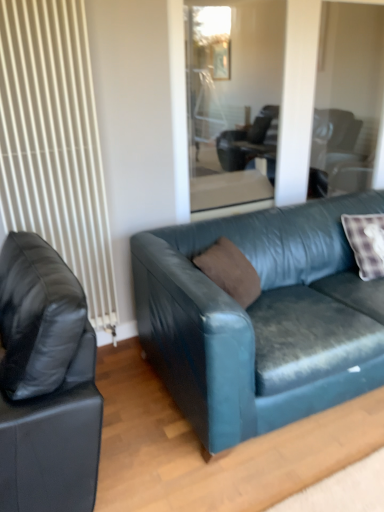
Question: Considering the relative sizes of white ribbed radiator at left and teal leather couch at center, which ranks as the second studio couch in left-to-right order, in the image provided, is white ribbed radiator at left bigger than teal leather couch at center, which ranks as the second studio couch in left-to-right order,?

Choices:
 (A) no
 (B) yes

Answer: (A)

Question: Is white ribbed radiator at left positioned far away from teal leather couch at center, which ranks as the second studio couch in left-to-right order?

Choices:
 (A) no
 (B) yes

Answer: (A)

Question: Considering the relative sizes of white ribbed radiator at left and teal leather couch at center, the 1th studio couch positioned from the right, in the image provided, is white ribbed radiator at left smaller than teal leather couch at center, the 1th studio couch positioned from the right,?

Choices:
 (A) yes
 (B) no

Answer: (A)

Question: Is white ribbed radiator at left thinner than teal leather couch at center, which ranks as the second studio couch in left-to-right order?

Choices:
 (A) no
 (B) yes

Answer: (B)

Question: From a real-world perspective, does white ribbed radiator at left stand above teal leather couch at center, which ranks as the second studio couch in left-to-right order?

Choices:
 (A) yes
 (B) no

Answer: (A)

Question: From the image's perspective, is white ribbed radiator at left on top of teal leather couch at center, the 1th studio couch positioned from the right?

Choices:
 (A) yes
 (B) no

Answer: (A)

Question: Can you confirm if brown suede pillow at center is taller than matte black leather couch at left, which appears as the second studio couch when viewed from the right?

Choices:
 (A) yes
 (B) no

Answer: (B)

Question: Is matte black leather couch at left, which appears as the second studio couch when viewed from the right, at the back of brown suede pillow at center?

Choices:
 (A) no
 (B) yes

Answer: (A)

Question: Can you confirm if brown suede pillow at center is wider than matte black leather couch at left, which ranks as the first studio couch in left-to-right order?

Choices:
 (A) yes
 (B) no

Answer: (B)

Question: Is brown suede pillow at center in contact with matte black leather couch at left, which appears as the second studio couch when viewed from the right?

Choices:
 (A) no
 (B) yes

Answer: (A)

Question: Would you say brown suede pillow at center is outside matte black leather couch at left, which appears as the second studio couch when viewed from the right?

Choices:
 (A) no
 (B) yes

Answer: (B)

Question: From a real-world perspective, does brown suede pillow at center stand above matte black leather couch at left, which ranks as the first studio couch in left-to-right order?

Choices:
 (A) no
 (B) yes

Answer: (B)

Question: Is brown suede pillow at center surrounding white ribbed radiator at left?

Choices:
 (A) no
 (B) yes

Answer: (A)